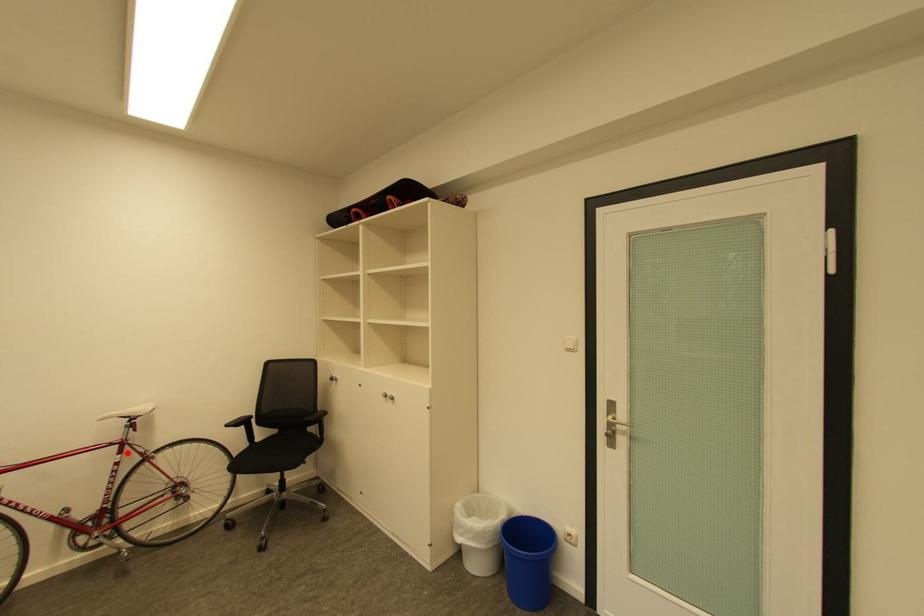
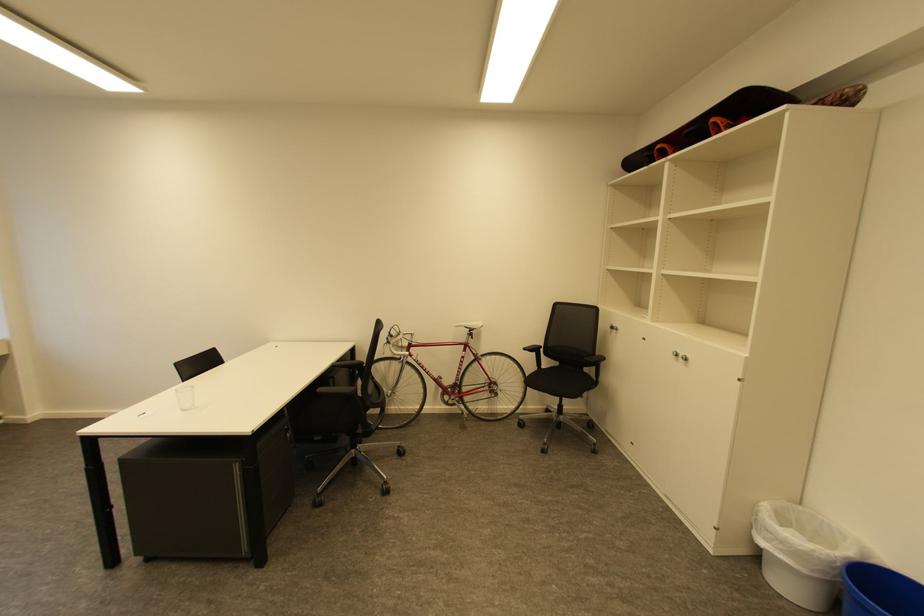
In the second image, find the point that corresponds to the highlighted location in the first image.

(471, 351)